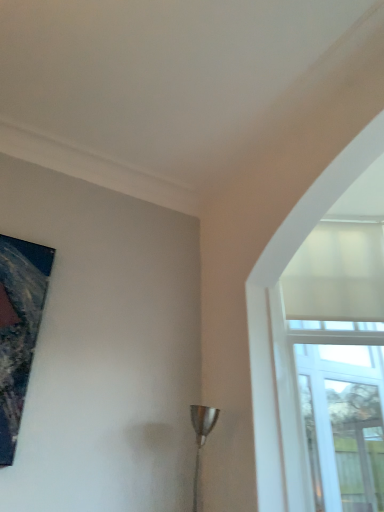
I want to click on metallic painting at upper left, so click(x=19, y=329).

Considering the relative sizes of white matte glass window at upper right and metallic silver lamp at lower center in the image provided, is white matte glass window at upper right taller than metallic silver lamp at lower center?

Yes.

In the image, is white matte glass window at upper right positioned in front of or behind metallic silver lamp at lower center?

white matte glass window at upper right is behind metallic silver lamp at lower center.

Does white matte glass window at upper right have a larger size compared to metallic silver lamp at lower center?

Yes, white matte glass window at upper right is bigger than metallic silver lamp at lower center.

This screenshot has height=512, width=384. What are the coordinates of `window located above the metallic silver lamp at lower center (from the image's perspective)` in the screenshot? It's located at (274, 284).

From a real-world perspective, is metallic silver lamp at lower center positioned under metallic painting at upper left based on gravity?

Yes, from a real-world perspective, metallic silver lamp at lower center is below metallic painting at upper left.

Which is more to the left, metallic silver lamp at lower center or metallic painting at upper left?

Positioned to the left is metallic painting at upper left.

Is metallic silver lamp at lower center in front of or behind metallic painting at upper left in the image?

metallic silver lamp at lower center is behind metallic painting at upper left.

Considering the positions of objects metallic silver lamp at lower center and white matte glass window at upper right in the image provided, who is more to the right, metallic silver lamp at lower center or white matte glass window at upper right?

From the viewer's perspective, white matte glass window at upper right appears more on the right side.

Is metallic silver lamp at lower center not near white matte glass window at upper right?

metallic silver lamp at lower center is near white matte glass window at upper right, not far away.

Is metallic silver lamp at lower center positioned with its back to white matte glass window at upper right?

No, white matte glass window at upper right is not at the back of metallic silver lamp at lower center.

Is metallic silver lamp at lower center inside the boundaries of white matte glass window at upper right, or outside?

metallic silver lamp at lower center exists outside the volume of white matte glass window at upper right.

Considering the relative positions of white matte glass window at upper right and metallic painting at upper left in the image provided, is white matte glass window at upper right to the left or to the right of metallic painting at upper left?

Based on their positions, white matte glass window at upper right is located to the right of metallic painting at upper left.

Is point (325, 202) closer or farther from the camera than point (40, 307)?

Clearly, point (325, 202) is more distant from the camera than point (40, 307).

Is white matte glass window at upper right directly adjacent to metallic painting at upper left?

No, white matte glass window at upper right is not next to metallic painting at upper left.

Consider the image. From a real-world perspective, is white matte glass window at upper right beneath metallic painting at upper left?

Incorrect, from a real-world perspective, white matte glass window at upper right is higher than metallic painting at upper left.

Is metallic painting at upper left wider or thinner than metallic silver lamp at lower center?

Considering their sizes, metallic painting at upper left looks slimmer than metallic silver lamp at lower center.

Which is closer to the camera, (13, 356) or (213, 421)?

Point (13, 356) is positioned closer to the camera compared to point (213, 421).

Considering the positions of objects metallic painting at upper left and metallic silver lamp at lower center in the image provided, who is behind, metallic painting at upper left or metallic silver lamp at lower center?

Positioned behind is metallic silver lamp at lower center.

Is white matte glass window at upper right at the back of metallic painting at upper left?

No, white matte glass window at upper right is not at the back of metallic painting at upper left.

Considering the sizes of objects metallic painting at upper left and white matte glass window at upper right in the image provided, who is shorter, metallic painting at upper left or white matte glass window at upper right?

With less height is metallic painting at upper left.

Considering the sizes of objects metallic painting at upper left and white matte glass window at upper right in the image provided, who is wider, metallic painting at upper left or white matte glass window at upper right?

white matte glass window at upper right is wider.

How much distance is there between metallic painting at upper left and white matte glass window at upper right?

The distance of metallic painting at upper left from white matte glass window at upper right is 1.30 meters.

You are a GUI agent. You are given a task and a screenshot of the screen. Output one action in this format:
    pyautogui.click(x=<x>, y=<y>)
    Task: Click on the lamp below the white matte glass window at upper right (from a real-world perspective)
    This screenshot has width=384, height=512.
    Given the screenshot: What is the action you would take?
    pyautogui.click(x=201, y=436)

Locate an element on the screen. picture frame in front of the metallic silver lamp at lower center is located at coordinates (19, 329).

Estimate the real-world distances between objects in this image. Which object is further from white matte glass window at upper right, metallic silver lamp at lower center or metallic painting at upper left?

metallic painting at upper left.

Considering their positions, is metallic painting at upper left positioned closer to white matte glass window at upper right than metallic silver lamp at lower center?

Among the two, metallic silver lamp at lower center is located nearer to white matte glass window at upper right.

From the image, which object appears to be nearer to metallic painting at upper left, white matte glass window at upper right or metallic silver lamp at lower center?

metallic silver lamp at lower center is closer to metallic painting at upper left.

Considering their positions, is metallic silver lamp at lower center positioned further to metallic painting at upper left than white matte glass window at upper right?

The object further to metallic painting at upper left is white matte glass window at upper right.

Looking at the image, which one is located further to metallic silver lamp at lower center, metallic painting at upper left or white matte glass window at upper right?

metallic painting at upper left is positioned further to the anchor metallic silver lamp at lower center.

Based on their spatial positions, is white matte glass window at upper right or metallic painting at upper left closer to metallic silver lamp at lower center?

white matte glass window at upper right is closer to metallic silver lamp at lower center.

The width and height of the screenshot is (384, 512). Identify the location of lamp between metallic painting at upper left and white matte glass window at upper right. (201, 436).